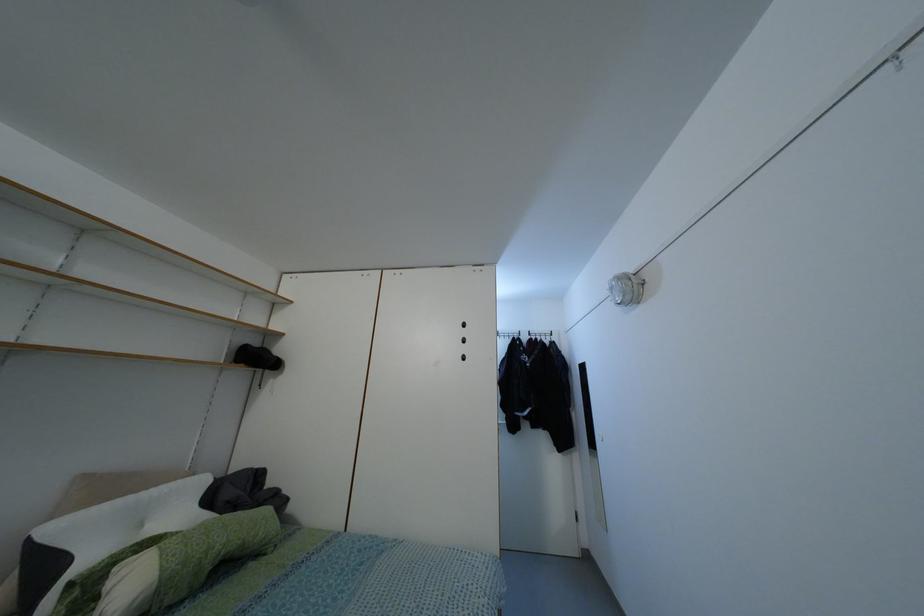
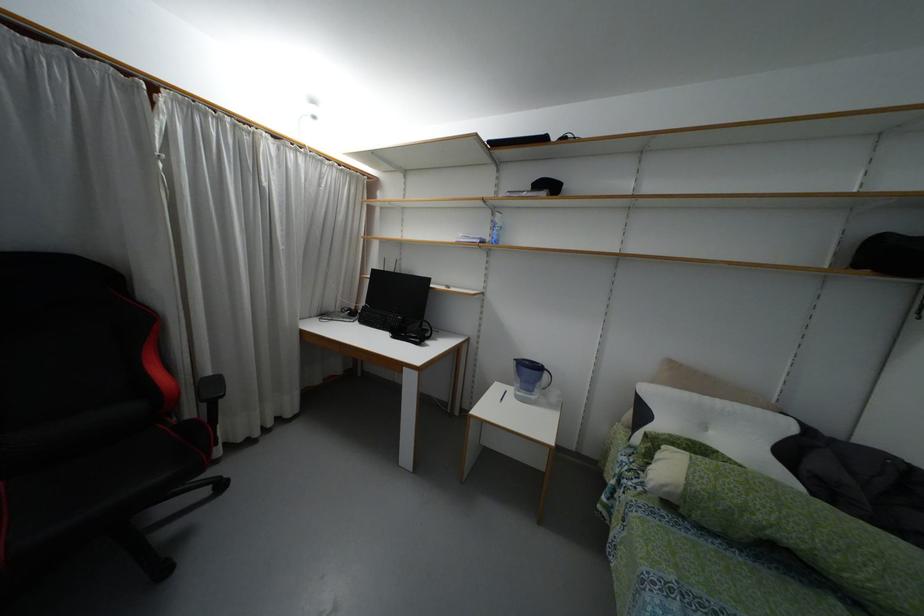
Where in the second image is the point corresponding to point 162,570 from the first image?

(687, 483)